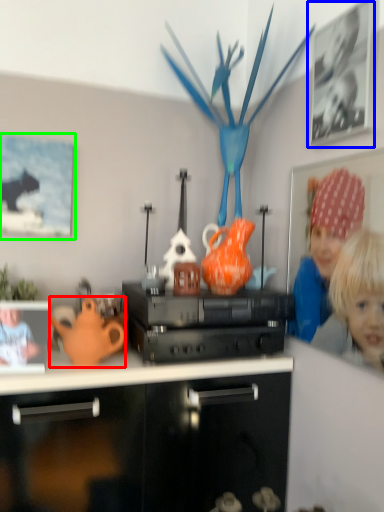
Question: Which object is the closest to the teapot (highlighted by a red box)? Choose among these: picture frame (highlighted by a blue box) or picture frame (highlighted by a green box).

Choices:
 (A) picture frame
 (B) picture frame

Answer: (B)